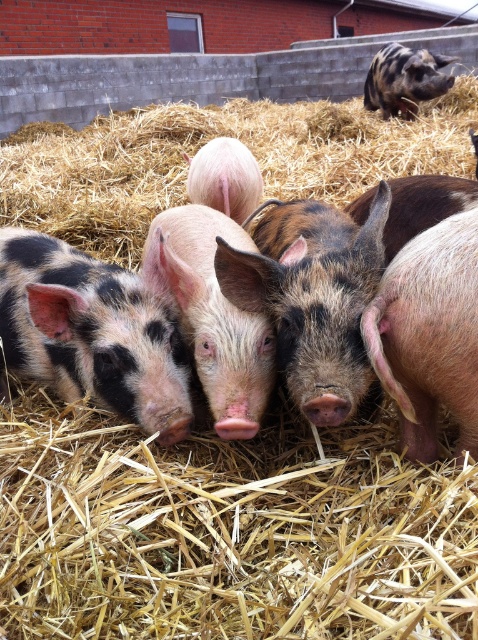
Measure the distance between pink soft skin at right and speckled brown pig at upper right.

They are 6.43 meters apart.

Who is higher up, pink soft skin at right or speckled brown pig at upper right?

speckled brown pig at upper right is above.

Measure the distance between point (x=458, y=308) and camera.

Point (x=458, y=308) is 4.12 feet away from camera.

The image size is (478, 640). What are the coordinates of `pink soft skin at right` in the screenshot? It's located at (430, 333).

Which is above, golden straw at center or speckled brown pig at upper right?

speckled brown pig at upper right is higher up.

Is golden straw at center to the right of speckled brown pig at upper right from the viewer's perspective?

Incorrect, golden straw at center is not on the right side of speckled brown pig at upper right.

Locate an element on the screen. golden straw at center is located at coordinates (208, 140).

Who is lower down, speckled pink pig at center or pink matte pig at center?

speckled pink pig at center

Does point (285, 371) come farther from viewer compared to point (252, 192)?

That is False.

Find the location of a particular element. speckled pink pig at center is located at coordinates (312, 296).